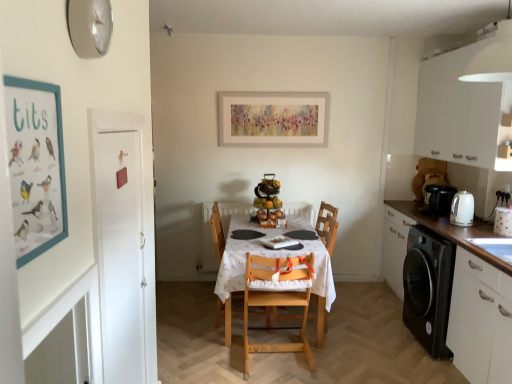
At what (x,y) coordinates should I click in order to perform the action: click on free space above white matte door at left (from a real-world perspective). Please return your answer as a coordinate pair (x, y). The width and height of the screenshot is (512, 384). Looking at the image, I should click on (122, 128).